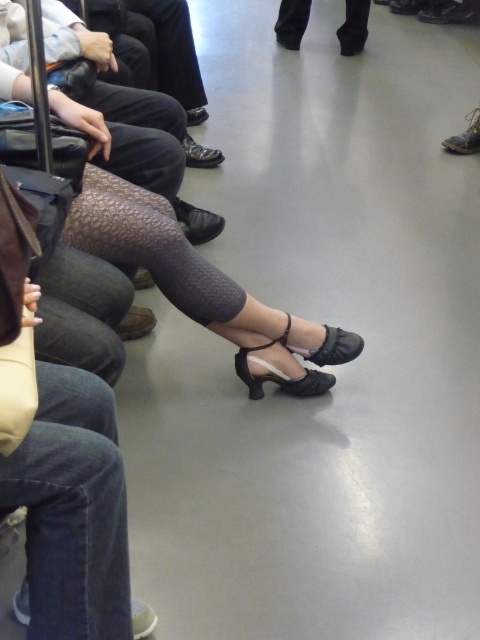
Question: Can you confirm if denim at left is positioned above matte black shoe at lower center?

Choices:
 (A) yes
 (B) no

Answer: (B)

Question: Where is matte black shoe at lower center located in relation to matte black shoe at center in the image?

Choices:
 (A) right
 (B) left

Answer: (B)

Question: Is matte black shoe at lower center smaller than matte black shoe at center?

Choices:
 (A) no
 (B) yes

Answer: (B)

Question: Which point is farther to the camera?

Choices:
 (A) (142, 314)
 (B) (311, 353)
 (C) (362, 16)

Answer: (C)

Question: Among these objects, which one is farthest from the camera?

Choices:
 (A) matte black heels at lower center
 (B) black leather sandal at lower center
 (C) black leather shoe at lower center

Answer: (C)

Question: Which object is the closest to the matte black shoe at lower center?

Choices:
 (A) leather boot at lower right
 (B) matte black shoe at center
 (C) matte black heels at lower center
 (D) black leather sandal at lower center

Answer: (C)